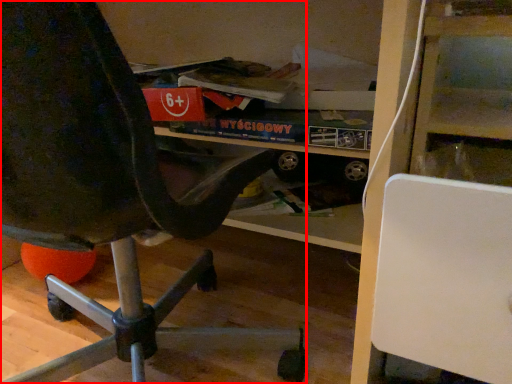
Question: From the image, what is the correct spatial relationship of chair (annotated by the red box) in relation to shelf?

Choices:
 (A) left
 (B) right

Answer: (A)